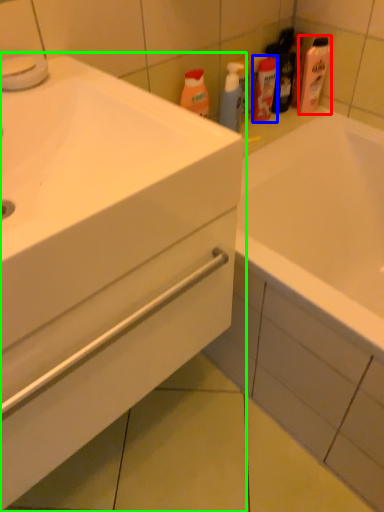
Question: Considering the real-world distances, which object is closest to cleaning product (highlighted by a red box)? mouthwash (highlighted by a blue box) or bathroom cabinet (highlighted by a green box).

Choices:
 (A) mouthwash
 (B) bathroom cabinet

Answer: (A)